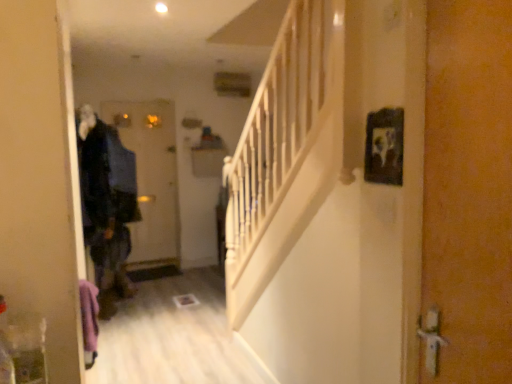
Question: Would you say matte black door at center, the second door viewed from the front, is to the left or to the right of orange textured door at right, arranged as the first door when viewed from the front, in the picture?

Choices:
 (A) left
 (B) right

Answer: (A)

Question: In the image, is matte black door at center, the second door when ordered from right to left, positioned in front of or behind orange textured door at right, which is the 2th door from back to front?

Choices:
 (A) front
 (B) behind

Answer: (B)

Question: Which object is positioned closest to the orange textured door at right, which is the first door from right to left?

Choices:
 (A) dark blue fabric coat at left
 (B) matte black door at center, which is the first door in left-to-right order
 (C) black matte picture frame at upper right

Answer: (C)

Question: Which of these objects is positioned closest to the matte black door at center, the second door viewed from the front?

Choices:
 (A) dark blue fabric coat at left
 (B) black matte picture frame at upper right
 (C) orange textured door at right, which is the 2th door from back to front

Answer: (A)